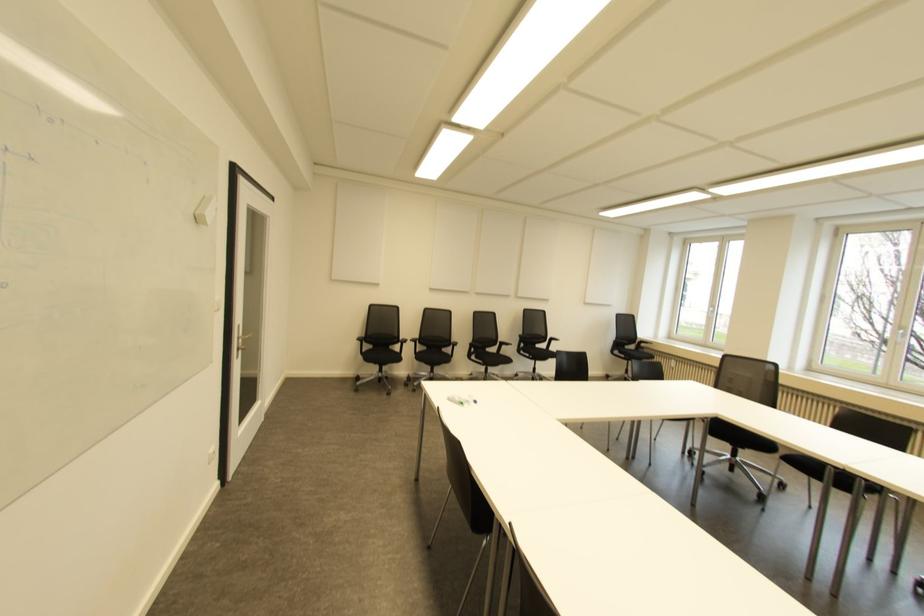
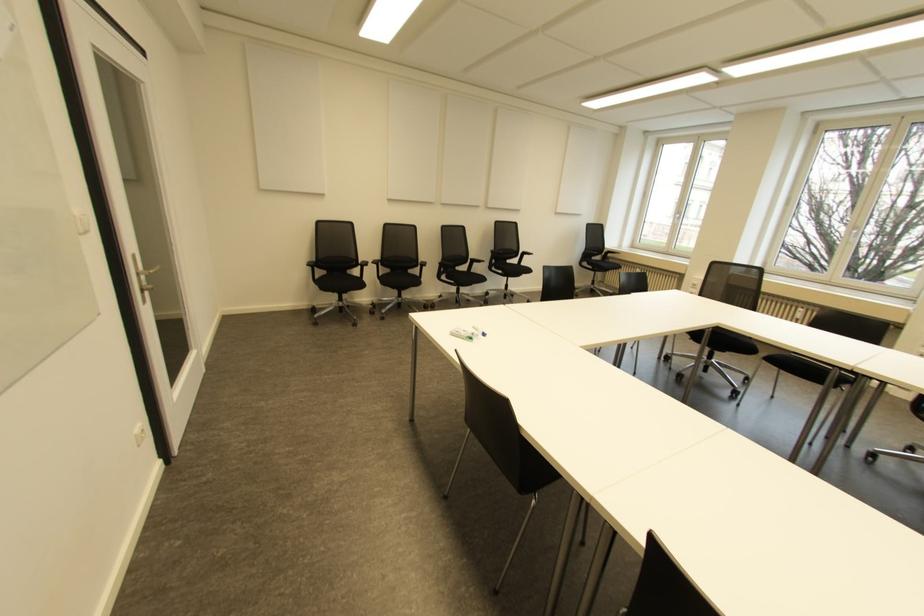
Find the pixel in the second image that matches (x=506, y=360) in the first image.

(480, 278)